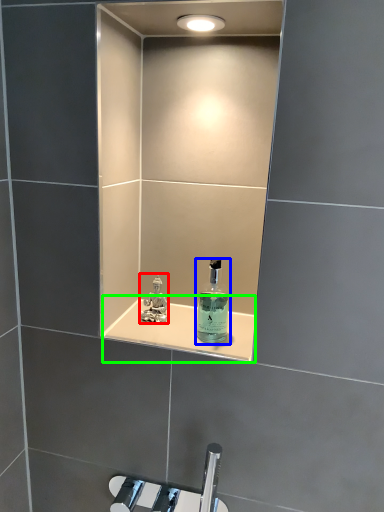
Question: Considering the real-world distances, which object is farthest from perfume (highlighted by a red box)? bottle (highlighted by a blue box) or shelve (highlighted by a green box)?

Choices:
 (A) bottle
 (B) shelve

Answer: (A)